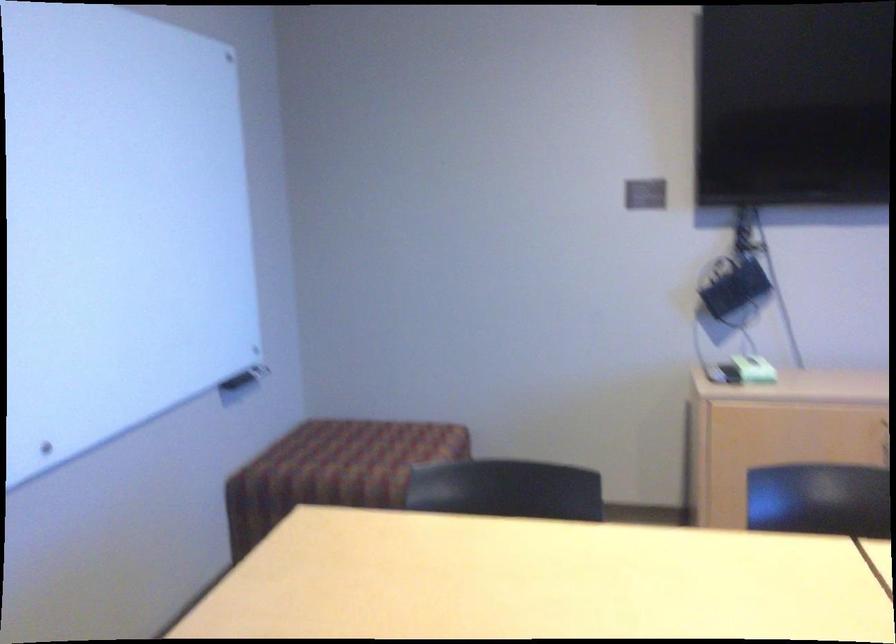
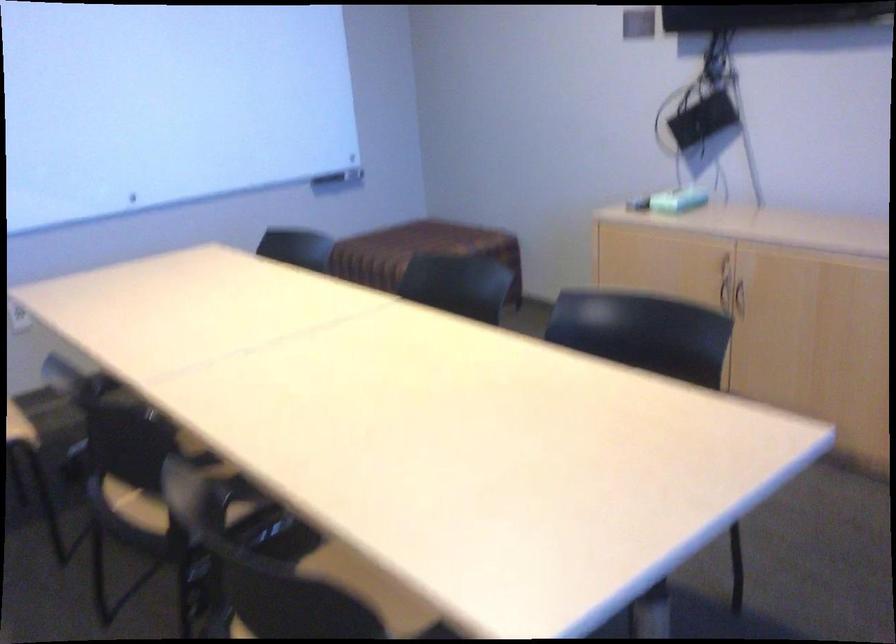
Locate, in the second image, the point that corresponds to (x=748, y=371) in the first image.

(677, 200)